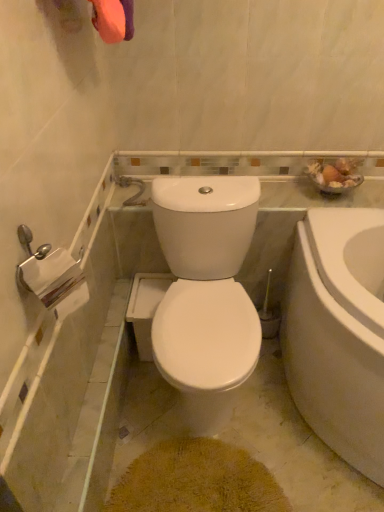
This screenshot has height=512, width=384. What do you see at coordinates (55, 281) in the screenshot?
I see `silver metallic toilet paper at left` at bounding box center [55, 281].

At what (x,y) coordinates should I click in order to perform the action: click on silver metallic toilet paper at left. Please return your answer as a coordinate pair (x, y). Looking at the image, I should click on (55, 281).

Identify the location of silver metallic toilet paper at left. (55, 281).